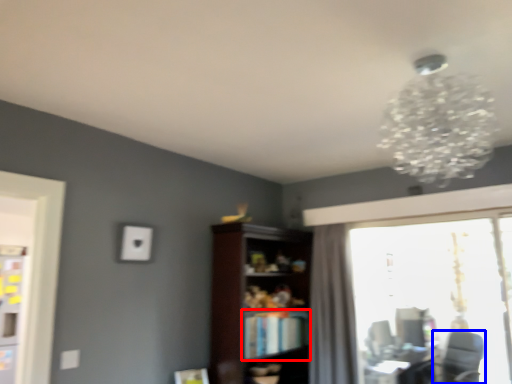
Question: Which object is closer to the camera taking this photo, book (highlighted by a red box) or swivel chair (highlighted by a blue box)?

Choices:
 (A) book
 (B) swivel chair

Answer: (A)